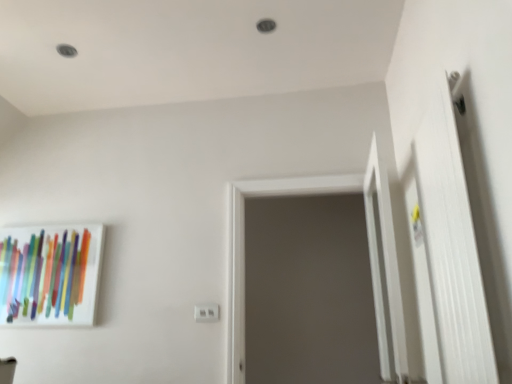
Question: Is white plastic electric outlet at center bigger or smaller than gray matte screen door at center?

Choices:
 (A) big
 (B) small

Answer: (B)

Question: From a real-world perspective, relative to gray matte screen door at center, is white plastic electric outlet at center vertically above or below?

Choices:
 (A) above
 (B) below

Answer: (B)

Question: Based on their relative distances, which object is farther from the white plastic electric outlet at center?

Choices:
 (A) white matte door at right
 (B) matte glass picture frame at left
 (C) gray matte screen door at center

Answer: (A)

Question: Which of these objects is positioned farthest from the gray matte screen door at center?

Choices:
 (A) matte glass picture frame at left
 (B) white matte door at right
 (C) white plastic electric outlet at center

Answer: (A)